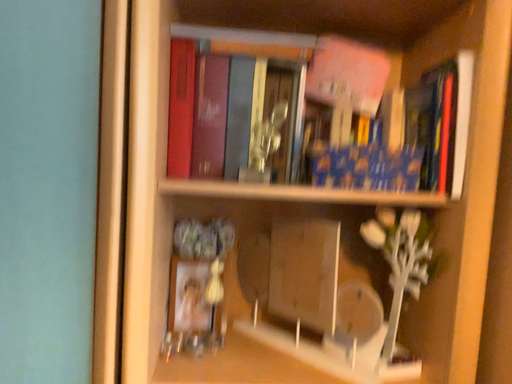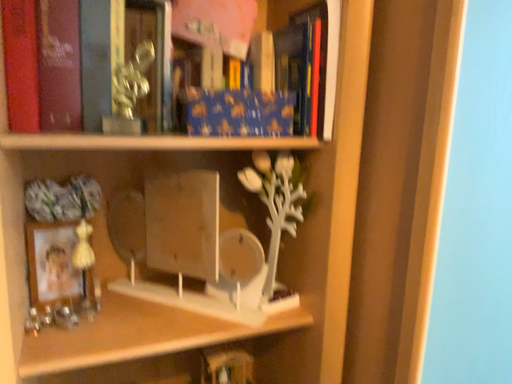
Question: Which way did the camera rotate in the video?

Choices:
 (A) rotated upward
 (B) rotated downward

Answer: (B)